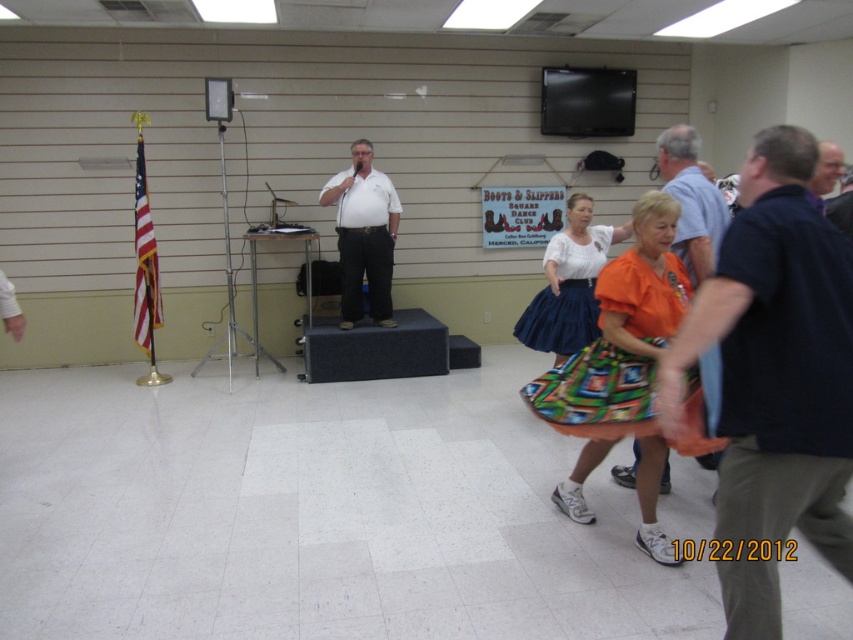
You are standing at the entrance of the square dance hall and see a point marked at coordinates (364, 236). Which object in the scene is located exactly at that point?

The point at coordinates (364, 236) is on the white matte shirt at center.

You are a photographer positioned at the back of the room. You want to take a photo that includes both the black cotton shirt at right and the white matte shirt at center. Which shirt should you adjust your camera focus to first to ensure both are in the frame?

The black cotton shirt at right is closer to the viewer than the white matte shirt at center, so you should focus on the black cotton shirt at right first to ensure both are in the frame.

You are a photographer at the event and want to capture a photo that includes both the black cotton shirt at right and the white matte shirt at center. Which shirt should you focus on first to ensure both are in frame?

Result: The black cotton shirt at right is not as tall as the white matte shirt at center, so you should focus on the white matte shirt at center first to ensure both are in frame.